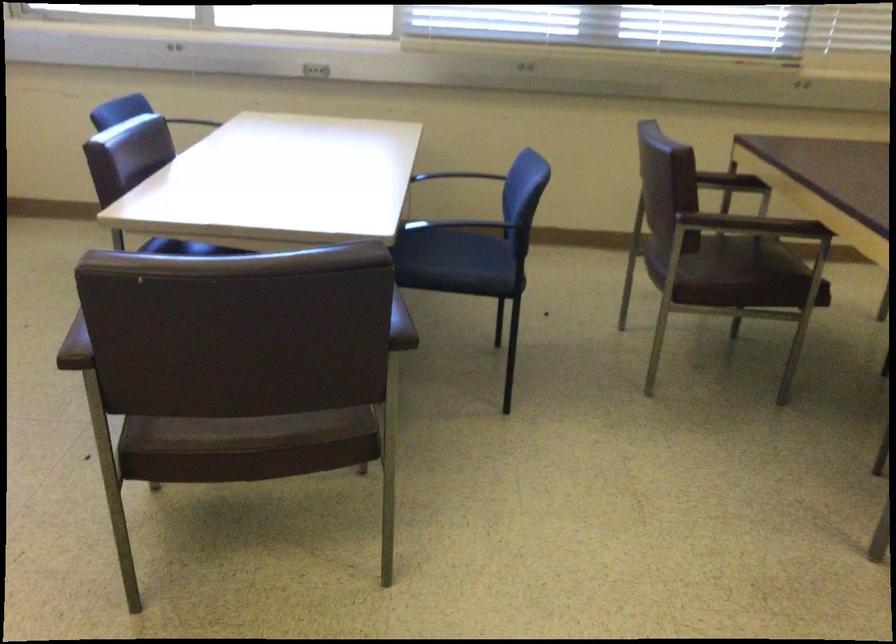
Describe the element at coordinates (458, 261) in the screenshot. This screenshot has height=644, width=896. I see `the blue chair sitting surface` at that location.